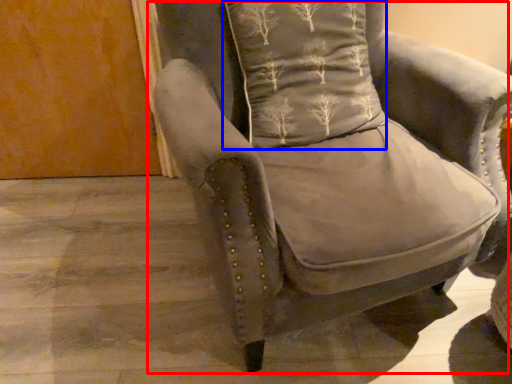
Question: Which point is further to the camera, chair (highlighted by a red box) or pillow (highlighted by a blue box)?

Choices:
 (A) chair
 (B) pillow

Answer: (B)